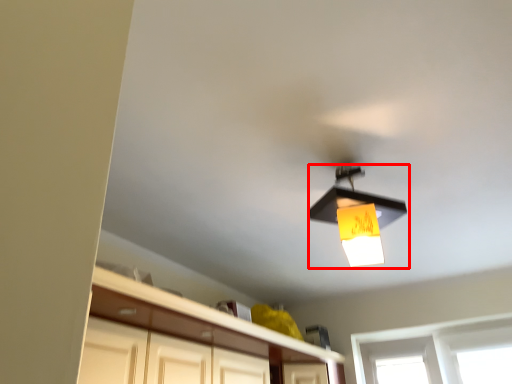
Question: Where is lamp (annotated by the red box) located in relation to cabinetry in the image?

Choices:
 (A) right
 (B) left

Answer: (A)